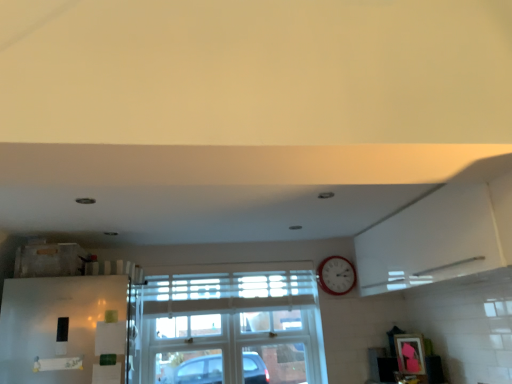
Describe the element at coordinates (336, 275) in the screenshot. The image size is (512, 384). I see `metallic red clock at upper right` at that location.

Where is `metallic red clock at upper right`? This screenshot has height=384, width=512. metallic red clock at upper right is located at coordinates (336, 275).

The height and width of the screenshot is (384, 512). In order to click on clear glass window at center in this screenshot , I will do `click(226, 325)`.

What do you see at coordinates (226, 325) in the screenshot? This screenshot has height=384, width=512. I see `clear glass window at center` at bounding box center [226, 325].

Identify the location of metallic red clock at upper right. (336, 275).

Between clear glass window at center and metallic red clock at upper right, which one appears on the right side from the viewer's perspective?

From the viewer's perspective, metallic red clock at upper right appears more on the right side.

Which object is more forward, clear glass window at center or metallic red clock at upper right?

clear glass window at center.

Which point is more forward, [280,273] or [345,287]?

The point [345,287] is closer.

From the image's perspective, is clear glass window at center located above or below metallic red clock at upper right?

Clearly, from the image's perspective, clear glass window at center is below metallic red clock at upper right.

From a real-world perspective, is clear glass window at center physically located above or below metallic red clock at upper right?

clear glass window at center is below metallic red clock at upper right.

Can you confirm if clear glass window at center is thinner than metallic red clock at upper right?

No.

Is clear glass window at center shorter than metallic red clock at upper right?

No, clear glass window at center is not shorter than metallic red clock at upper right.

Is clear glass window at center smaller than metallic red clock at upper right?

Incorrect, clear glass window at center is not smaller in size than metallic red clock at upper right.

Can we say clear glass window at center lies outside metallic red clock at upper right?

clear glass window at center is positioned outside metallic red clock at upper right.

Would you consider clear glass window at center to be distant from metallic red clock at upper right?

No.

Is clear glass window at center turned away from metallic red clock at upper right?

clear glass window at center does not have its back to metallic red clock at upper right.

How much distance is there between clear glass window at center and metallic red clock at upper right?

They are 24.91 inches apart.

The image size is (512, 384). In the image, there is a clear glass window at center. In order to click on clock above it (from the image's perspective) in this screenshot , I will do pyautogui.click(x=336, y=275).

Can you confirm if metallic red clock at upper right is positioned to the left of clear glass window at center?

No.

Does metallic red clock at upper right come in front of clear glass window at center?

No, metallic red clock at upper right is further to the viewer.

Considering the points (334, 270) and (233, 267), which point is behind, point (334, 270) or point (233, 267)?

The point (233, 267) is farther from the camera.

From the image's perspective, between metallic red clock at upper right and clear glass window at center, which one is located above?

metallic red clock at upper right.

From a real-world perspective, which is physically above, metallic red clock at upper right or clear glass window at center?

metallic red clock at upper right is physically above.

Considering the sizes of objects metallic red clock at upper right and clear glass window at center in the image provided, who is thinner, metallic red clock at upper right or clear glass window at center?

metallic red clock at upper right is thinner.

Is metallic red clock at upper right taller than clear glass window at center?

No, metallic red clock at upper right is not taller than clear glass window at center.

Can you confirm if metallic red clock at upper right is smaller than clear glass window at center?

Indeed, metallic red clock at upper right has a smaller size compared to clear glass window at center.

Would you say metallic red clock at upper right is outside clear glass window at center?

Yes, metallic red clock at upper right is located beyond the bounds of clear glass window at center.

Is metallic red clock at upper right far from clear glass window at center?

They are positioned close to each other.

Is metallic red clock at upper right facing away from clear glass window at center?

That's not correct — metallic red clock at upper right is not looking away from clear glass window at center.

The image size is (512, 384). What are the coordinates of `clock on the right of clear glass window at center` in the screenshot? It's located at 336,275.

Find the location of `clock lying above the clear glass window at center (from the image's perspective)`. clock lying above the clear glass window at center (from the image's perspective) is located at coordinates (336, 275).

You are a GUI agent. You are given a task and a screenshot of the screen. Output one action in this format:
    pyautogui.click(x=<x>, y=<y>)
    Task: Click on the window below the metallic red clock at upper right (from the image's perspective)
    The image size is (512, 384).
    Given the screenshot: What is the action you would take?
    pyautogui.click(x=226, y=325)